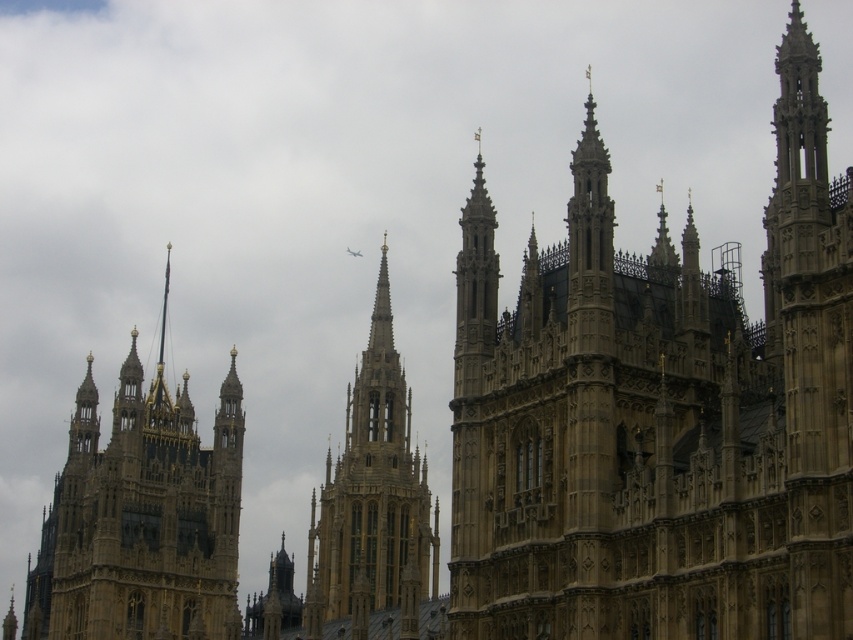
Question: Considering the relative positions of golden stone spire at left and golden stone spire at center in the image provided, where is golden stone spire at left located with respect to golden stone spire at center?

Choices:
 (A) above
 (B) below

Answer: (A)

Question: Can you confirm if golden stone spire at left is positioned to the right of golden stone spire at center?

Choices:
 (A) no
 (B) yes

Answer: (A)

Question: Which of these objects is positioned closest to the golden stone tower at center?

Choices:
 (A) golden stone spire at center
 (B) golden stone spire at left

Answer: (A)

Question: From the image, what is the correct spatial relationship of golden stone tower at center in relation to golden stone spire at left?

Choices:
 (A) right
 (B) left

Answer: (A)

Question: Which point appears farthest from the camera in this image?

Choices:
 (A) (608, 624)
 (B) (154, 435)

Answer: (B)

Question: Estimate the real-world distances between objects in this image. Which object is closer to the golden stone spire at left?

Choices:
 (A) golden stone tower at center
 (B) golden stone spire at center

Answer: (B)